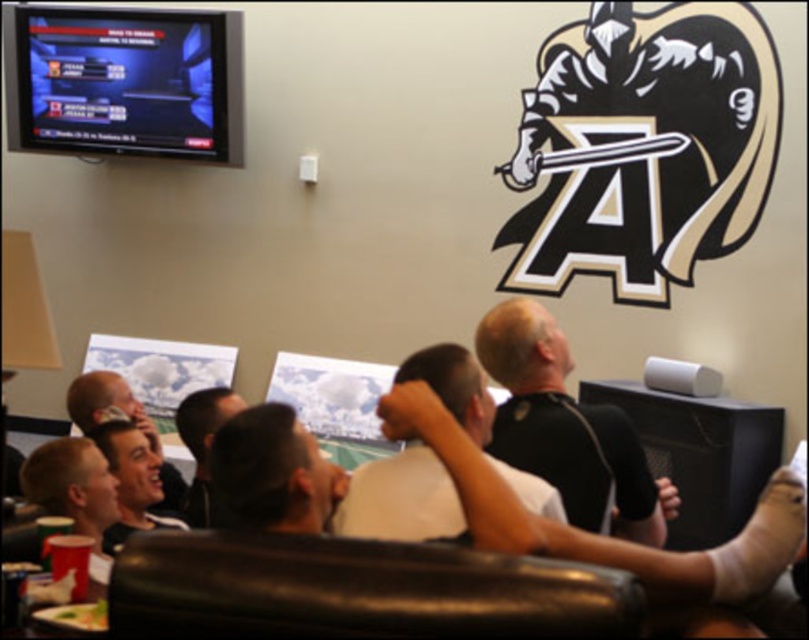
You are a guest at this gathering and want to sit as close as possible to the TV. Which object should you choose between the black leather couch at lower center and the matte black shirt at lower left?

The black leather couch at lower center is smaller in size compared to the matte black shirt at lower left, but since the couch is furniture and the shirt is an article of clothing, you should choose the black leather couch at lower center to sit closer to the TV.